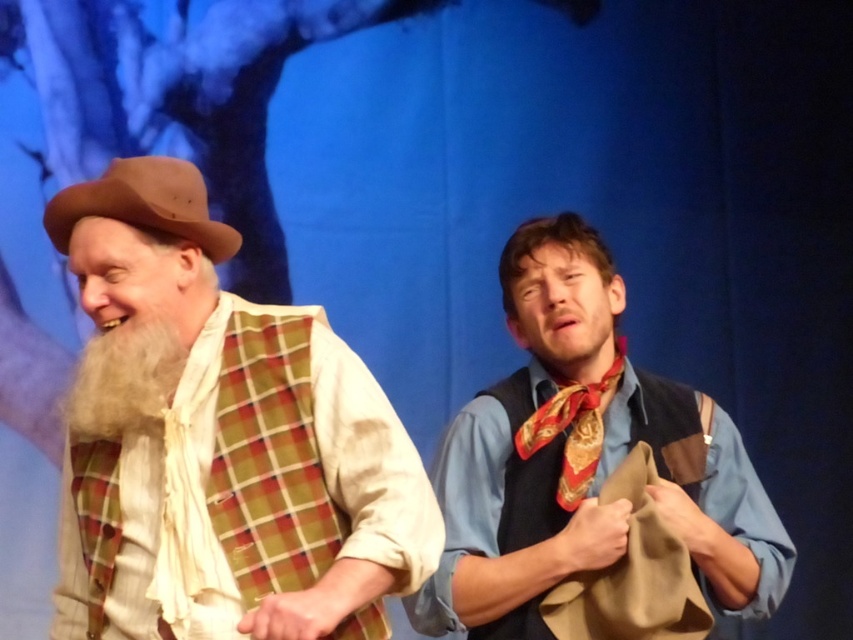
Question: Considering the real-world distances, which object is farthest from the white fluffy beard at left?

Choices:
 (A) blue denim shirt at center
 (B) gold-patterned silk tie at center
 (C) brown leather cowboy hat at left
 (D) matte brown hat at left

Answer: (B)

Question: Which of the following is the closest to the observer?

Choices:
 (A) white fluffy beard at left
 (B) blue denim shirt at center
 (C) matte brown hat at left
 (D) gold-patterned silk tie at center

Answer: (C)

Question: Is blue denim shirt at center to the right of gold-patterned silk tie at center from the viewer's perspective?

Choices:
 (A) no
 (B) yes

Answer: (A)

Question: Which object is the farthest from the matte brown hat at left?

Choices:
 (A) brown leather cowboy hat at left
 (B) blue denim shirt at center
 (C) white fluffy beard at left

Answer: (B)

Question: Does blue denim shirt at center have a lesser width compared to gold-patterned silk tie at center?

Choices:
 (A) yes
 (B) no

Answer: (B)

Question: Is matte brown hat at left further to the viewer compared to brown leather cowboy hat at left?

Choices:
 (A) no
 (B) yes

Answer: (A)